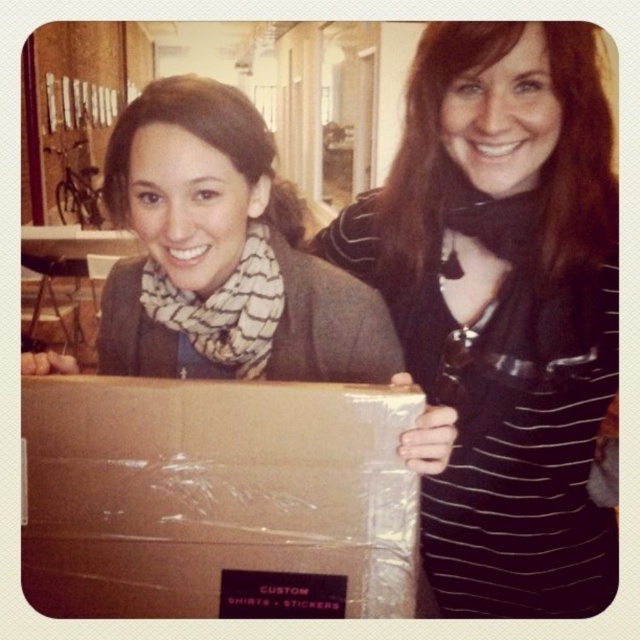
The image size is (640, 640). I want to click on black striped shirt at center, so click(504, 305).

Where is `black striped shirt at center`? black striped shirt at center is located at coordinates tap(504, 305).

Image resolution: width=640 pixels, height=640 pixels. What are the coordinates of `black striped shirt at center` in the screenshot? It's located at (504, 305).